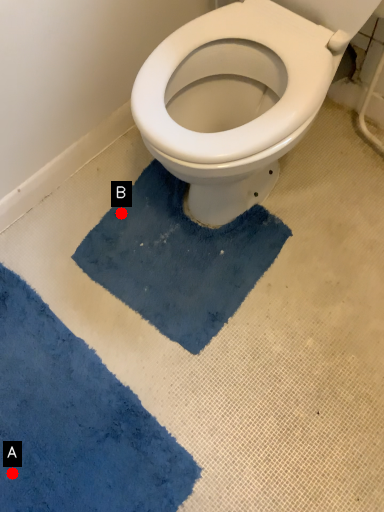
Question: Two points are circled on the image, labeled by A and B beside each circle. Which point is closer to the camera?

Choices:
 (A) A is closer
 (B) B is closer

Answer: (A)